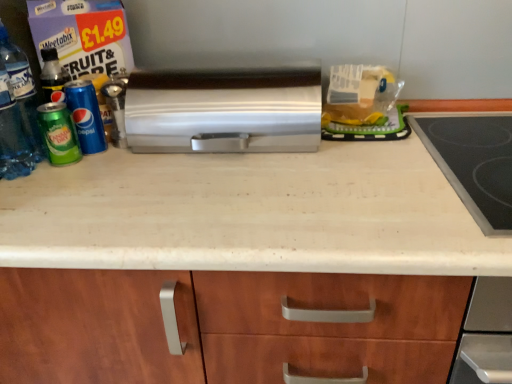
Question: Is white laminate countertop at center surrounded by translucent plastic bag at upper center?

Choices:
 (A) yes
 (B) no

Answer: (B)

Question: Is translucent plastic bag at upper center looking in the opposite direction of white laminate countertop at center?

Choices:
 (A) yes
 (B) no

Answer: (B)

Question: Could you tell me if translucent plastic bag at upper center is facing white laminate countertop at center?

Choices:
 (A) yes
 (B) no

Answer: (B)

Question: From a real-world perspective, is translucent plastic bag at upper center located beneath white laminate countertop at center?

Choices:
 (A) yes
 (B) no

Answer: (B)

Question: Is translucent plastic bag at upper center bigger than white laminate countertop at center?

Choices:
 (A) no
 (B) yes

Answer: (A)

Question: Is translucent plastic bag at upper center outside of white laminate countertop at center?

Choices:
 (A) yes
 (B) no

Answer: (A)

Question: Would you say white laminate countertop at center contains satin silver toaster at center?

Choices:
 (A) yes
 (B) no

Answer: (B)

Question: Does white laminate countertop at center have a lesser height compared to satin silver toaster at center?

Choices:
 (A) no
 (B) yes

Answer: (A)

Question: Is white laminate countertop at center with satin silver toaster at center?

Choices:
 (A) yes
 (B) no

Answer: (B)

Question: From the image's perspective, is white laminate countertop at center over satin silver toaster at center?

Choices:
 (A) yes
 (B) no

Answer: (B)

Question: From a real-world perspective, is white laminate countertop at center physically below satin silver toaster at center?

Choices:
 (A) yes
 (B) no

Answer: (A)

Question: Is white laminate countertop at center completely or partially outside of satin silver toaster at center?

Choices:
 (A) no
 (B) yes

Answer: (B)

Question: Does green matte can at left, the 1th beverage positioned from the left, have a smaller size compared to satin silver toaster at center?

Choices:
 (A) no
 (B) yes

Answer: (B)